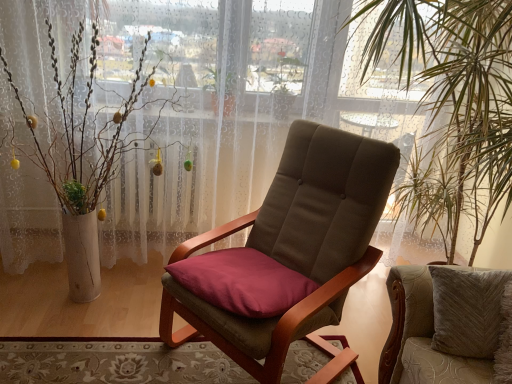
Locate an element on the screen. The image size is (512, 384). white textured vase at left is located at coordinates (83, 127).

The width and height of the screenshot is (512, 384). In order to click on carpeted rug at lower left in this screenshot , I will do `click(116, 363)`.

Describe the element at coordinates (421, 337) in the screenshot. The image size is (512, 384). I see `velvet beige cushion at center, the 2th chair positioned from the left` at that location.

Find the location of a particular element. The height and width of the screenshot is (384, 512). white textured vase at left is located at coordinates (83, 127).

Between brown fabric chair at center, the first chair in the left-to-right sequence, and velvet beige cushion at center, the 2th chair positioned from the left, which one has smaller size?

With smaller size is velvet beige cushion at center, the 2th chair positioned from the left.

Is point (161, 335) positioned after point (403, 271)?

Yes.

From a real-world perspective, is brown fabric chair at center, the first chair in the left-to-right sequence, located higher than velvet beige cushion at center, the 2th chair positioned from the left?

No, from a real-world perspective, brown fabric chair at center, the first chair in the left-to-right sequence, is not on top of velvet beige cushion at center, the 2th chair positioned from the left.

Considering the sizes of objects white textured vase at left and velvet beige cushion at center, positioned as the first chair in right-to-left order, in the image provided, who is thinner, white textured vase at left or velvet beige cushion at center, positioned as the first chair in right-to-left order,?

Thinner between the two is velvet beige cushion at center, positioned as the first chair in right-to-left order.

How different are the orientations of white textured vase at left and velvet beige cushion at center, positioned as the first chair in right-to-left order, in degrees?

The angular difference between white textured vase at left and velvet beige cushion at center, positioned as the first chair in right-to-left order, is 9.89 degrees.

Considering the points (0, 57) and (431, 303), which point is in front, point (0, 57) or point (431, 303)?

Positioned in front is point (431, 303).

Based on the photo, considering the sizes of white textured vase at left and velvet beige cushion at center, positioned as the first chair in right-to-left order, in the image, is white textured vase at left taller or shorter than velvet beige cushion at center, positioned as the first chair in right-to-left order,?

In the image, white textured vase at left appears to be taller than velvet beige cushion at center, positioned as the first chair in right-to-left order.

Does white textured vase at left have a lesser width compared to green leafy plant at right?

Yes, white textured vase at left is thinner than green leafy plant at right.

From the image's perspective, is white textured vase at left on green leafy plant at right?

Yes, from the image's perspective, white textured vase at left is over green leafy plant at right.

Considering the relative positions of white textured vase at left and green leafy plant at right in the image provided, is white textured vase at left behind green leafy plant at right?

That is True.

How different are the orientations of white textured vase at left and carpeted rug at lower left in degrees?

white textured vase at left and carpeted rug at lower left are facing 90.1 degrees away from each other.

Between white textured vase at left and carpeted rug at lower left, which one has more height?

white textured vase at left.

Can we say white textured vase at left lies outside carpeted rug at lower left?

Absolutely, white textured vase at left is external to carpeted rug at lower left.

Based on the photo, considering the positions of objects white textured vase at left and carpeted rug at lower left in the image provided, who is more to the right, white textured vase at left or carpeted rug at lower left?

Positioned to the right is carpeted rug at lower left.

How many degrees apart are the facing directions of carpeted rug at lower left and white textured vase at left?

The facing directions of carpeted rug at lower left and white textured vase at left are 90.1 degrees apart.

Would you say carpeted rug at lower left is to the left or to the right of white textured vase at left in the picture?

carpeted rug at lower left is to the right of white textured vase at left.

Which of these two, carpeted rug at lower left or white textured vase at left, stands shorter?

With less height is carpeted rug at lower left.

Is carpeted rug at lower left oriented away from white textured vase at left?

carpeted rug at lower left is not turned away from white textured vase at left.

Which of these two, brown fabric chair at center, the first chair in the left-to-right sequence, or carpeted rug at lower left, stands taller?

brown fabric chair at center, the first chair in the left-to-right sequence, is taller.

How many degrees apart are the facing directions of brown fabric chair at center, which is the 2th chair in right-to-left order, and carpeted rug at lower left?

142 degrees separate the facing orientations of brown fabric chair at center, which is the 2th chair in right-to-left order, and carpeted rug at lower left.

Based on the photo, considering the positions of objects brown fabric chair at center, the first chair in the left-to-right sequence, and carpeted rug at lower left in the image provided, who is behind, brown fabric chair at center, the first chair in the left-to-right sequence, or carpeted rug at lower left?

carpeted rug at lower left.

Does point (348, 153) appear closer or farther from the camera than point (146, 383)?

Point (348, 153).

Is carpeted rug at lower left aimed at green leafy plant at right?

Yes, carpeted rug at lower left is facing green leafy plant at right.

From a real-world perspective, is carpeted rug at lower left on green leafy plant at right?

No, from a real-world perspective, carpeted rug at lower left is not above green leafy plant at right.

Is carpeted rug at lower left at the right side of green leafy plant at right?

No.

Locate an element on the screen. chair on the right of the brown fabric chair at center, the first chair in the left-to-right sequence is located at coordinates (421, 337).

Where is `floral arrangement above the velvet beige cushion at center, positioned as the first chair in right-to-left order (from the image's perspective)`? floral arrangement above the velvet beige cushion at center, positioned as the first chair in right-to-left order (from the image's perspective) is located at coordinates (83, 127).

Estimate the real-world distances between objects in this image. Which object is closer to green leafy plant at right, velvet beige cushion at center, the 2th chair positioned from the left, or carpeted rug at lower left?

velvet beige cushion at center, the 2th chair positioned from the left.

Estimate the real-world distances between objects in this image. Which object is further from green leafy plant at right, velvet beige cushion at center, the 2th chair positioned from the left, or white textured vase at left?

white textured vase at left.

When comparing their distances from white textured vase at left, does velvet beige cushion at center, the 2th chair positioned from the left, or green leafy plant at right seem further?

The object further to white textured vase at left is velvet beige cushion at center, the 2th chair positioned from the left.

Based on the photo, which object lies nearer to the anchor point green leafy plant at right, white textured vase at left or brown fabric chair at center, which is the 2th chair in right-to-left order?

brown fabric chair at center, which is the 2th chair in right-to-left order, lies closer to green leafy plant at right than the other object.

Based on their spatial positions, is carpeted rug at lower left or green leafy plant at right closer to white textured vase at left?

Among the two, carpeted rug at lower left is located nearer to white textured vase at left.

Considering their positions, is carpeted rug at lower left positioned closer to green leafy plant at right than white textured vase at left?

Based on the image, carpeted rug at lower left appears to be nearer to green leafy plant at right.

From the image, which object appears to be nearer to velvet beige cushion at center, positioned as the first chair in right-to-left order, green leafy plant at right or white textured vase at left?

green leafy plant at right is closer to velvet beige cushion at center, positioned as the first chair in right-to-left order.

Estimate the real-world distances between objects in this image. Which object is closer to brown fabric chair at center, the first chair in the left-to-right sequence, carpeted rug at lower left or white textured vase at left?

Based on the image, carpeted rug at lower left appears to be nearer to brown fabric chair at center, the first chair in the left-to-right sequence.

Find the location of a particular element. Image resolution: width=512 pixels, height=384 pixels. chair between brown fabric chair at center, which is the 2th chair in right-to-left order, and green leafy plant at right is located at coordinates coord(421,337).

You are a GUI agent. You are given a task and a screenshot of the screen. Output one action in this format:
    pyautogui.click(x=<x>, y=<y>)
    Task: Click on the chair located between carpeted rug at lower left and velvet beige cushion at center, the 2th chair positioned from the left, in the left-right direction
    
    Given the screenshot: What is the action you would take?
    pyautogui.click(x=296, y=244)

Find the location of a particular element. This screenshot has height=384, width=512. mat located between white textured vase at left and velvet beige cushion at center, the 2th chair positioned from the left, in the left-right direction is located at coordinates (116, 363).

The height and width of the screenshot is (384, 512). Find the location of `mat located between white textured vase at left and green leafy plant at right in the left-right direction`. mat located between white textured vase at left and green leafy plant at right in the left-right direction is located at coordinates (116, 363).